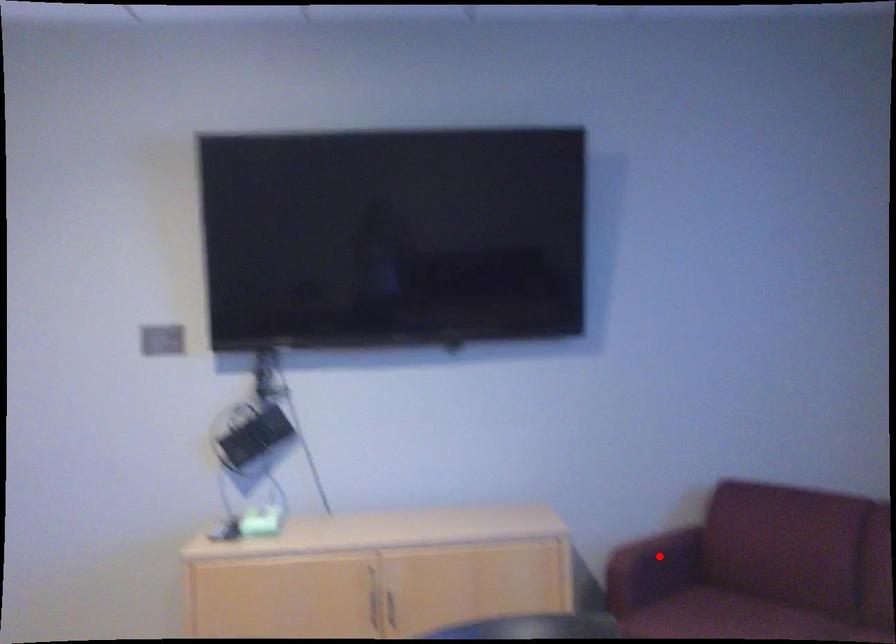
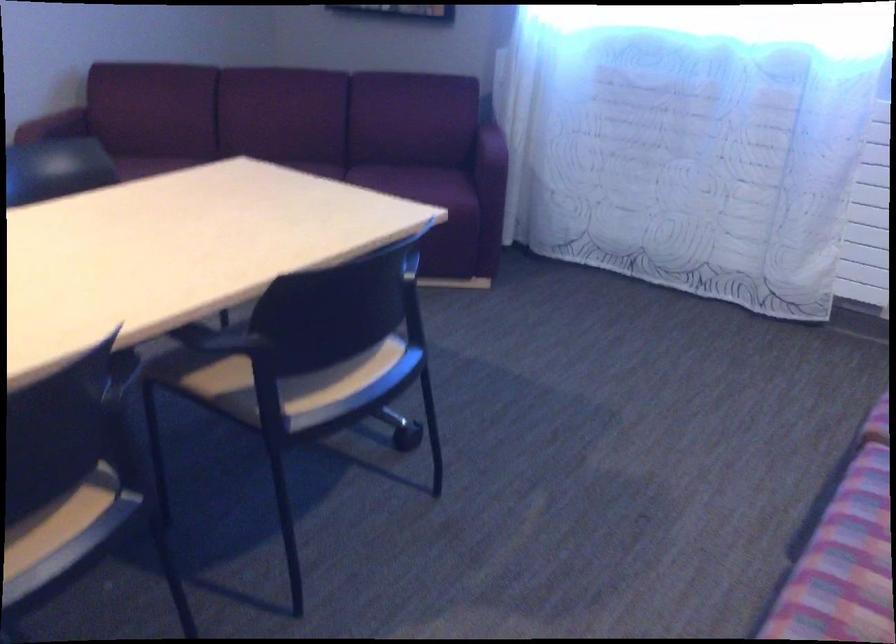
Where in the second image is the point corresponding to the highlighted location from the first image?

(54, 125)